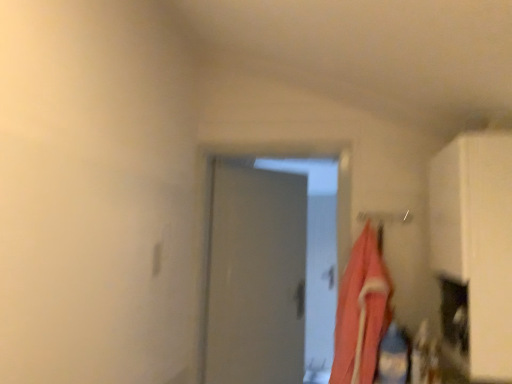
Question: Is matte pink fabric at right at the left side of white matte cabinet at right?

Choices:
 (A) yes
 (B) no

Answer: (A)

Question: Is matte pink fabric at right at the right side of white matte cabinet at right?

Choices:
 (A) yes
 (B) no

Answer: (B)

Question: Does matte pink fabric at right have a smaller size compared to white matte cabinet at right?

Choices:
 (A) no
 (B) yes

Answer: (B)

Question: Is matte pink fabric at right far away from white matte cabinet at right?

Choices:
 (A) no
 (B) yes

Answer: (A)

Question: Is matte pink fabric at right oriented away from white matte cabinet at right?

Choices:
 (A) no
 (B) yes

Answer: (A)

Question: From the image's perspective, is matte pink fabric at right located beneath white matte cabinet at right?

Choices:
 (A) no
 (B) yes

Answer: (B)

Question: From the image's perspective, does white matte cabinet at right appear lower than matte pink fabric at right?

Choices:
 (A) no
 (B) yes

Answer: (A)

Question: From a real-world perspective, is white matte cabinet at right located higher than matte pink fabric at right?

Choices:
 (A) yes
 (B) no

Answer: (A)

Question: Is white matte cabinet at right positioned far away from matte pink fabric at right?

Choices:
 (A) no
 (B) yes

Answer: (A)

Question: Does white matte cabinet at right have a lesser width compared to matte pink fabric at right?

Choices:
 (A) yes
 (B) no

Answer: (B)

Question: Could matte pink fabric at right be considered to be inside white matte cabinet at right?

Choices:
 (A) no
 (B) yes

Answer: (A)

Question: Is white matte cabinet at right facing towards matte pink fabric at right?

Choices:
 (A) no
 (B) yes

Answer: (B)

Question: Considering the positions of matte pink fabric at right and white matte cabinet at right in the image, is matte pink fabric at right wider or thinner than white matte cabinet at right?

Choices:
 (A) wide
 (B) thin

Answer: (B)